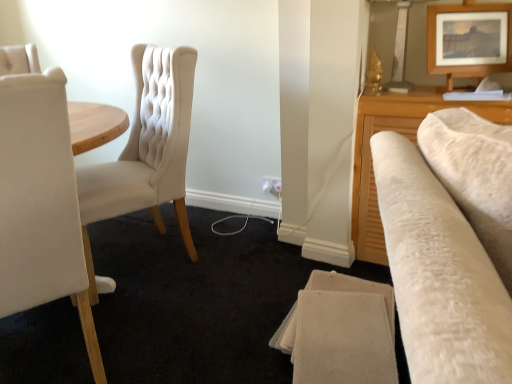
Locate an element on the screen. The image size is (512, 384). vacant area located to the right-hand side of white leather chair at left, placed as the first chair when sorted from front to back is located at coordinates (176, 332).